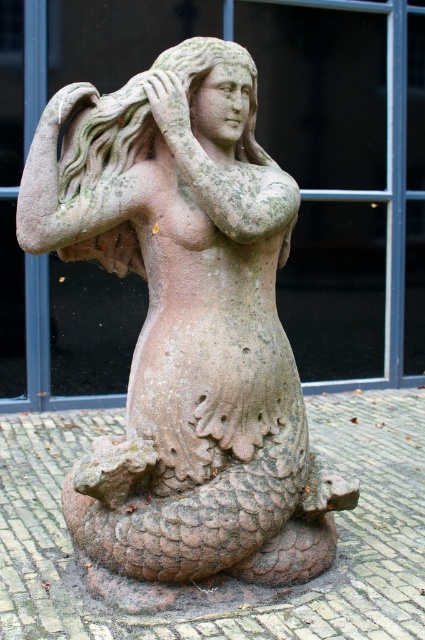
You are an art restorer examining the sculpture. You need to determine which part of the sculpture is taller between the green mossy stone mermaid at center and the green stone head at center. Which one is taller?

The green mossy stone mermaid at center is much taller than the green stone head at center.

You are an art conservator measuring the distance between the green stone head at center and the matte stone hand at upper center for restoration purposes. The minimum safe distance for the equipment you are using is 4 inches. Is the current distance sufficient for your equipment?

The green stone head at center is 3.95 inches away from the matte stone hand at upper center. Since the minimum safe distance required is 4 inches, the equipment cannot be used as the current distance is slightly less than the required safety margin.

You are an art conservator examining the sculpture located at point (187, 330). Based on the description, what is the condition of the sculpture?

The green mossy stone mermaid at center located at point (187, 330) has patches of green moss or lichen covering its surface, indicating exposure to the elements over time and a weathered appearance.